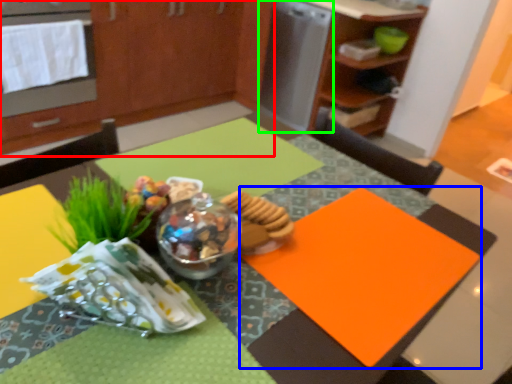
Question: Based on their relative distances, which object is farther from cabinetry (highlighted by a red box)? Choose from place mat (highlighted by a blue box) and appliance (highlighted by a green box).

Choices:
 (A) place mat
 (B) appliance

Answer: (A)